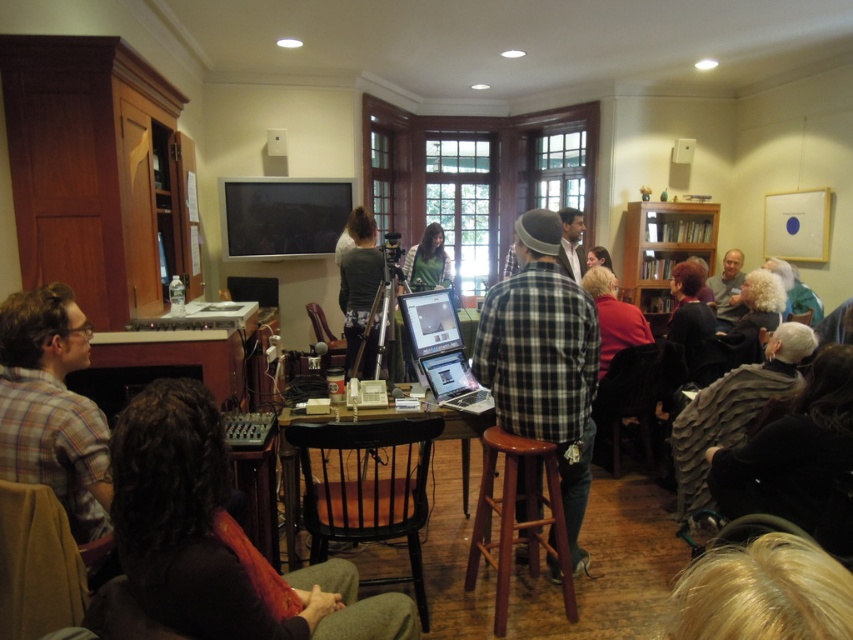
You are attending a meeting in this room and need to identify the speaker based on their clothing. Which person is likely the speaker, the plaid fabric shirt at left or the green matte shirt at center?

The plaid fabric shirt at left is taller than the green matte shirt at center, so the speaker is likely the person wearing the plaid fabric shirt at left since they are standing taller and facing the audience.

From the picture: You are attending a meeting in this room and need to identify who is speaking. Based on the image, which person is positioned lower in the scene between the plaid flannel shirt at center and the blonde hair at lower right?

The plaid flannel shirt at center is positioned below the blonde hair at lower right, so the person with the plaid flannel shirt at center is lower in the scene.

Looking at this image, you are attending a meeting and need to see both the plaid fabric shirt at left and the green matte shirt at center. Which one is closer to you?

The plaid fabric shirt at left is closer to you because it is in front of the green matte shirt at center.